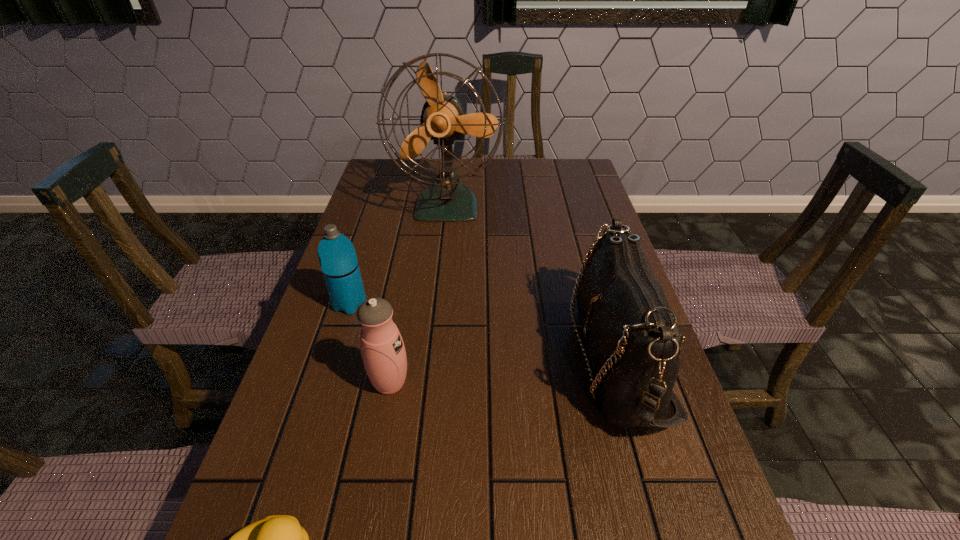
In order to click on vacant space situated on the back of the farther thermos bottle in this screenshot , I will do `click(360, 272)`.

Where is `object that is positioned at the far edge`? The image size is (960, 540). object that is positioned at the far edge is located at coordinates (442, 120).

The image size is (960, 540). Identify the location of fan that is positioned at the left edge. (442, 120).

This screenshot has width=960, height=540. I want to click on object that is at the right edge, so click(x=632, y=335).

What are the coordinates of `object that is at the far left corner` in the screenshot? It's located at (442, 120).

Find the location of a particular element. free spot at the far edge of the desktop is located at coordinates (431, 172).

This screenshot has width=960, height=540. I want to click on free space at the left edge of the desktop, so click(x=373, y=232).

Where is `vacant position at the right edge of the desktop`? vacant position at the right edge of the desktop is located at coordinates (566, 211).

I want to click on vacant region at the far right corner of the desktop, so click(x=545, y=164).

Find the location of a particular element. The height and width of the screenshot is (540, 960). free spot between the tallest object and the farther thermos bottle is located at coordinates 398,254.